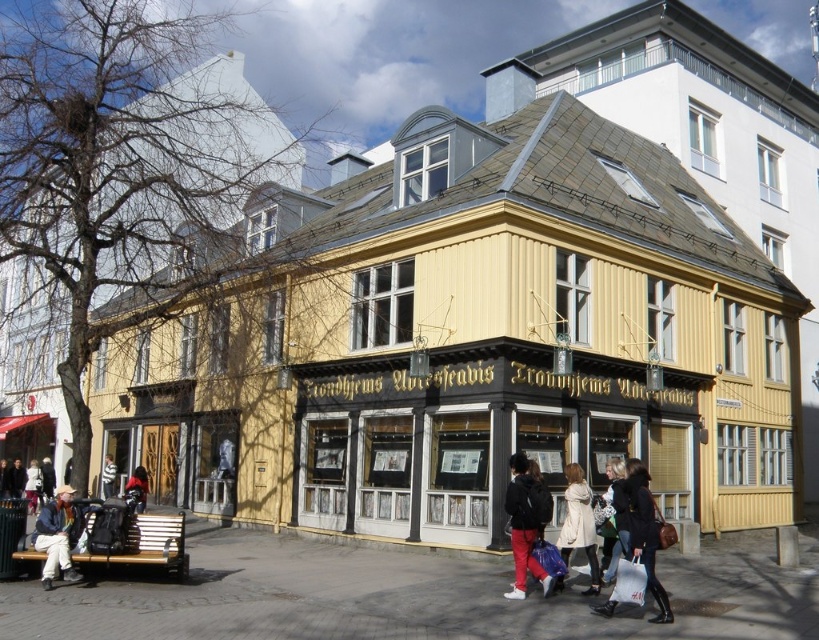
Does yellow wood building at center have a lesser width compared to dark red jacket at lower left?

Incorrect, yellow wood building at center's width is not less than dark red jacket at lower left's.

Is the position of yellow wood building at center more distant than that of dark red jacket at lower left?

No.

Which is in front, point (403, 488) or point (143, 474)?

Point (403, 488) is in front.

Locate an element on the screen. Image resolution: width=819 pixels, height=640 pixels. yellow wood building at center is located at coordinates (473, 340).

Which is in front, point (423, 516) or point (28, 493)?

Positioned in front is point (423, 516).

Does black wood/blackboard at center come behind light brown leather jacket at lower left?

That is False.

Does point (347, 376) come farther from viewer compared to point (29, 502)?

No, (347, 376) is in front of (29, 502).

This screenshot has width=819, height=640. Find the location of `black wood/blackboard at center`. black wood/blackboard at center is located at coordinates (469, 432).

Between light brown leather jacket at lower left and dark blue jacket at lower left, which one has more height?

light brown leather jacket at lower left is taller.

Can you confirm if light brown leather jacket at lower left is positioned above dark blue jacket at lower left?

Incorrect, light brown leather jacket at lower left is not positioned above dark blue jacket at lower left.

You are a GUI agent. You are given a task and a screenshot of the screen. Output one action in this format:
    pyautogui.click(x=<x>, y=<y>)
    Task: Click on the light brown leather jacket at lower left
    
    Given the screenshot: What is the action you would take?
    pyautogui.click(x=32, y=484)